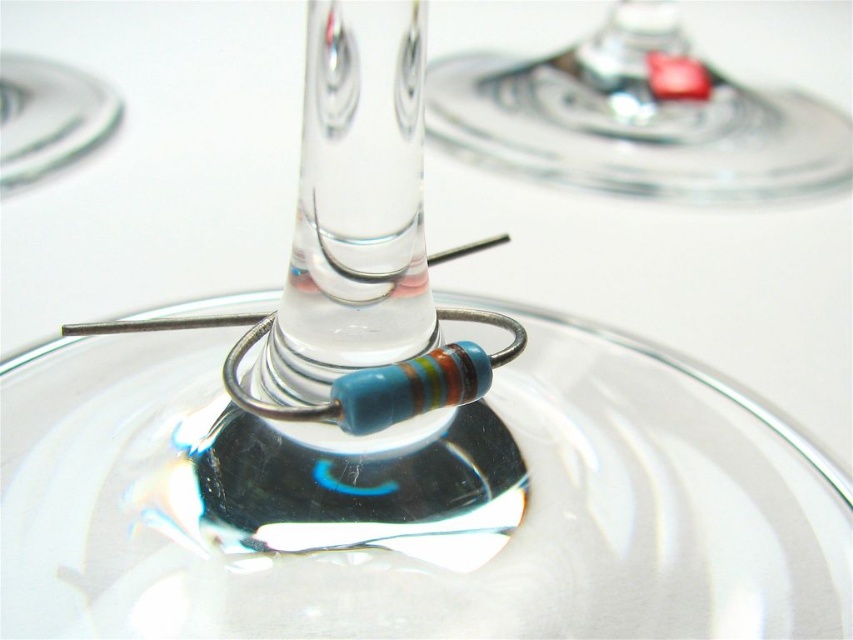
Question: Is transparent glass at center positioned before transparent glass at upper center?

Choices:
 (A) yes
 (B) no

Answer: (A)

Question: Which of the following is the farthest from the observer?

Choices:
 (A) transparent glass at center
 (B) transparent glass at upper center

Answer: (B)

Question: Among these objects, which one is nearest to the camera?

Choices:
 (A) transparent glass at center
 (B) transparent glass at upper center

Answer: (A)

Question: Is transparent glass at center thinner than transparent glass at upper center?

Choices:
 (A) yes
 (B) no

Answer: (A)

Question: Does transparent glass at center appear over transparent glass at upper center?

Choices:
 (A) no
 (B) yes

Answer: (A)